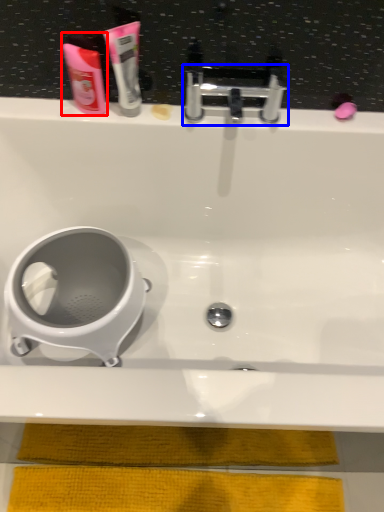
Question: Which of the following is the closest to the observer, mouthwash (highlighted by a red box) or tap (highlighted by a blue box)?

Choices:
 (A) mouthwash
 (B) tap

Answer: (A)